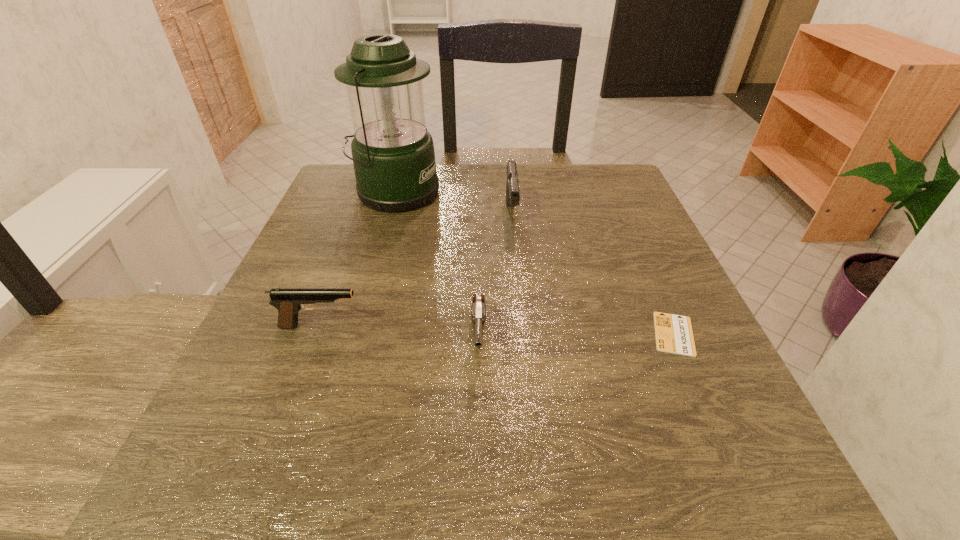
The image size is (960, 540). I want to click on lantern, so click(393, 155).

Where is `the fourth shortest object`? This screenshot has height=540, width=960. the fourth shortest object is located at coordinates (512, 188).

Find the location of `the rightmost pistol`. the rightmost pistol is located at coordinates (512, 188).

You are a GUI agent. You are given a task and a screenshot of the screen. Output one action in this format:
    pyautogui.click(x=<x>, y=<y>)
    Task: Click on the second pistol from right to left
    
    Given the screenshot: What is the action you would take?
    pyautogui.click(x=478, y=308)

The image size is (960, 540). Identify the location of the leftmost pistol. (289, 301).

Where is `the rightmost object`? the rightmost object is located at coordinates (674, 334).

You are a GUI agent. You are given a task and a screenshot of the screen. Output one action in this format:
    pyautogui.click(x=<x>, y=<y>)
    Task: Click on the identity card
    
    Given the screenshot: What is the action you would take?
    pyautogui.click(x=674, y=334)

Find the location of a particular element. This screenshot has height=540, width=960. free region located 0.100m on the front of the lantern is located at coordinates (381, 240).

Where is `vacant space located 0.290m aim along the barrel of the second tallest object`? Image resolution: width=960 pixels, height=540 pixels. vacant space located 0.290m aim along the barrel of the second tallest object is located at coordinates (524, 335).

In order to click on free space located at the barrel of the second pistol from right to left in this screenshot , I will do `click(478, 483)`.